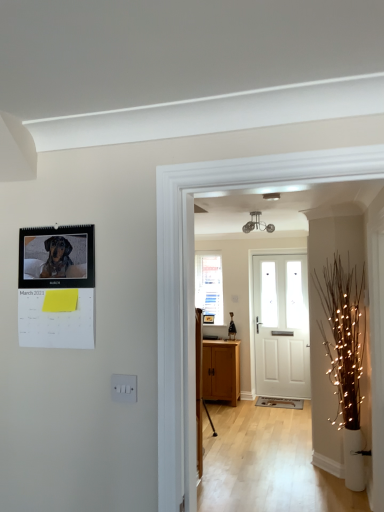
Question: Does white painted wood door at center have a smaller size compared to wooden cabinet at center?

Choices:
 (A) no
 (B) yes

Answer: (B)

Question: From a real-world perspective, is white painted wood door at center physically above wooden cabinet at center?

Choices:
 (A) no
 (B) yes

Answer: (B)

Question: From the image's perspective, does white painted wood door at center appear lower than wooden cabinet at center?

Choices:
 (A) no
 (B) yes

Answer: (A)

Question: Does white painted wood door at center come behind wooden cabinet at center?

Choices:
 (A) no
 (B) yes

Answer: (B)

Question: Is wooden cabinet at center at the back of white painted wood door at center?

Choices:
 (A) no
 (B) yes

Answer: (A)

Question: Looking at their shapes, would you say illuminated twig at right is wider or thinner than wooden cabinet at center?

Choices:
 (A) thin
 (B) wide

Answer: (B)

Question: From their relative heights in the image, would you say illuminated twig at right is taller or shorter than wooden cabinet at center?

Choices:
 (A) tall
 (B) short

Answer: (A)

Question: From the image's perspective, is illuminated twig at right above or below wooden cabinet at center?

Choices:
 (A) above
 (B) below

Answer: (A)

Question: Relative to wooden cabinet at center, is illuminated twig at right in front or behind?

Choices:
 (A) front
 (B) behind

Answer: (A)

Question: Does point (271, 379) appear closer or farther from the camera than point (208, 275)?

Choices:
 (A) farther
 (B) closer

Answer: (B)

Question: From a real-world perspective, is white painted wood door at center positioned above or below clear glass window at center?

Choices:
 (A) below
 (B) above

Answer: (A)

Question: Based on their sizes in the image, would you say white painted wood door at center is bigger or smaller than clear glass window at center?

Choices:
 (A) small
 (B) big

Answer: (B)

Question: Do you think white painted wood door at center is within clear glass window at center, or outside of it?

Choices:
 (A) inside
 (B) outside

Answer: (B)

Question: From the image's perspective, is clear glass window at center above or below illuminated twig at right?

Choices:
 (A) above
 (B) below

Answer: (A)

Question: In the image, is clear glass window at center positioned in front of or behind illuminated twig at right?

Choices:
 (A) behind
 (B) front

Answer: (A)